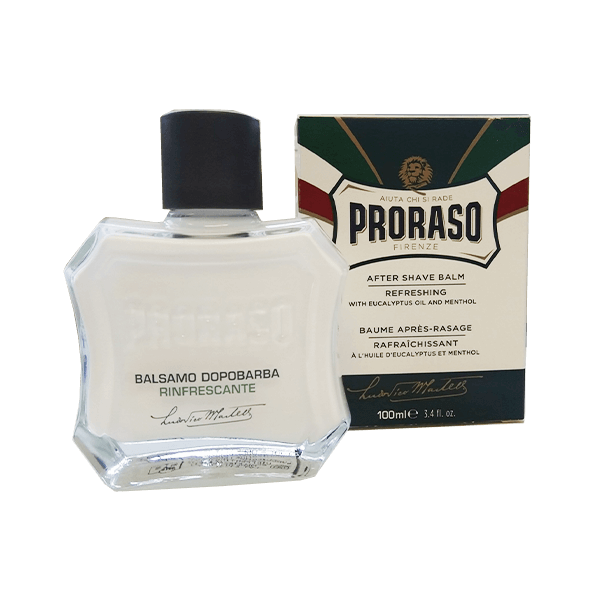
Locate an element on the screen. The image size is (600, 600). box is located at coordinates (514, 280).